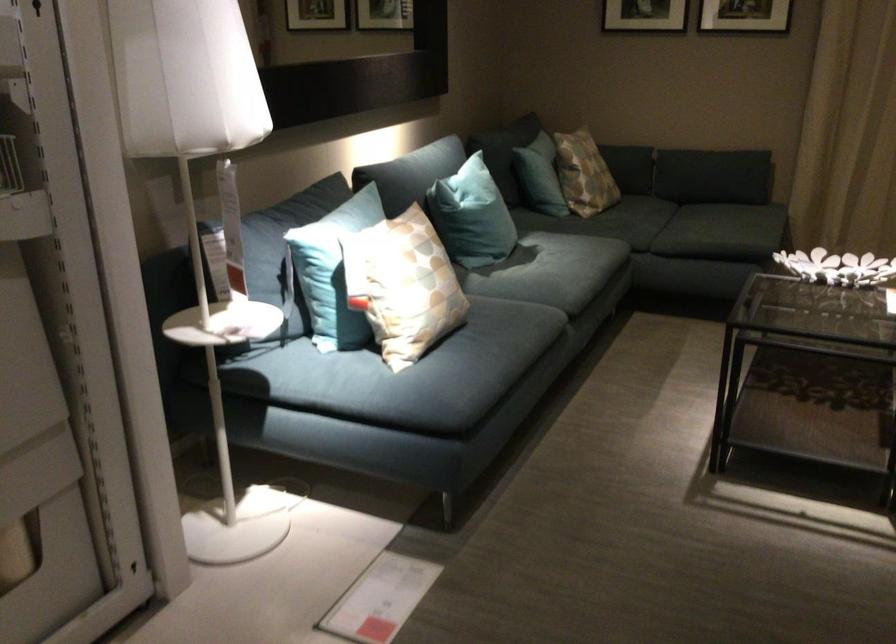
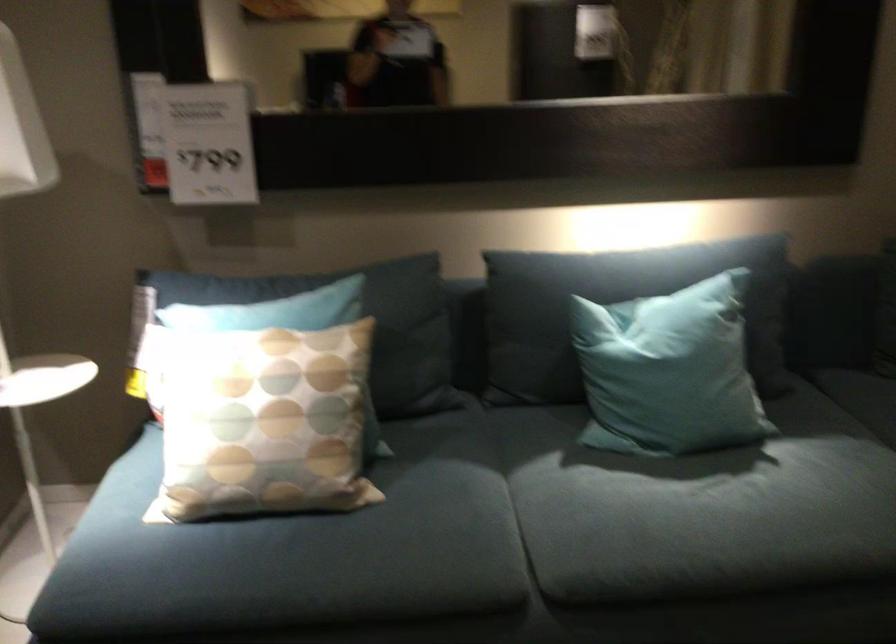
Locate, in the second image, the point that corresponds to (x=498, y=207) in the first image.

(668, 371)